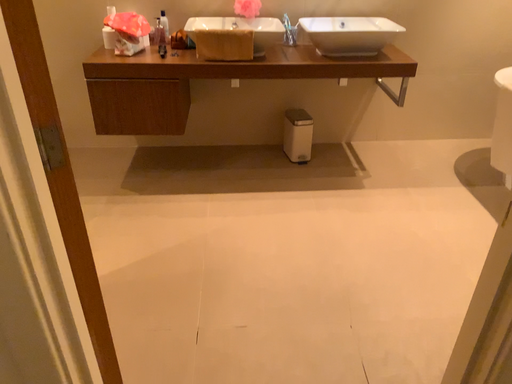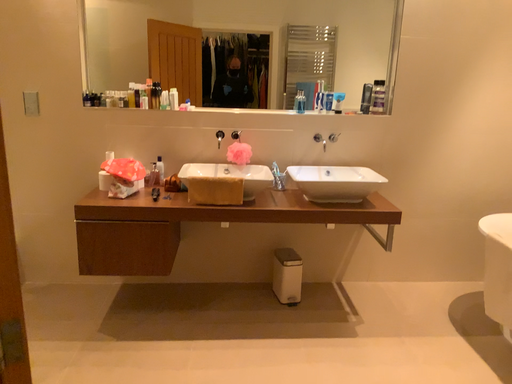
Question: Which way did the camera rotate in the video?

Choices:
 (A) rotated downward
 (B) rotated upward

Answer: (B)